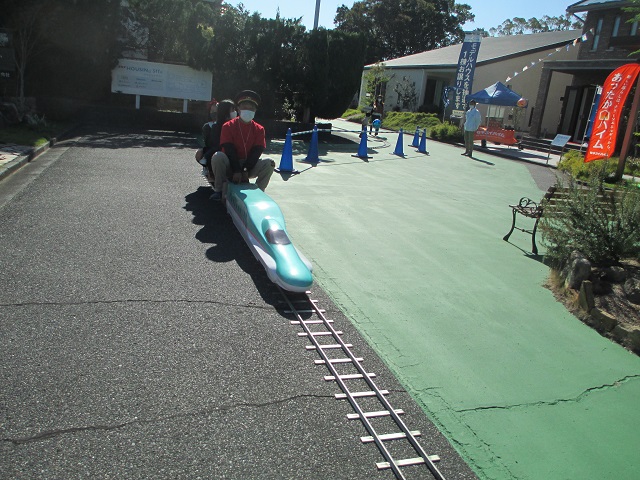
Find the location of a particular element. This screenshot has height=480, width=640. bench is located at coordinates (536, 214).